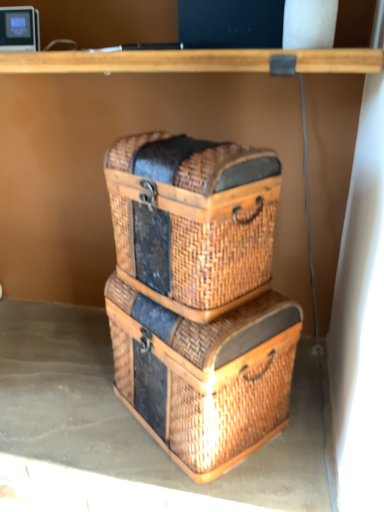
Where is `free space above woven brown basket at center (from a real-world perspective)`? This screenshot has height=512, width=384. free space above woven brown basket at center (from a real-world perspective) is located at coordinates (178, 141).